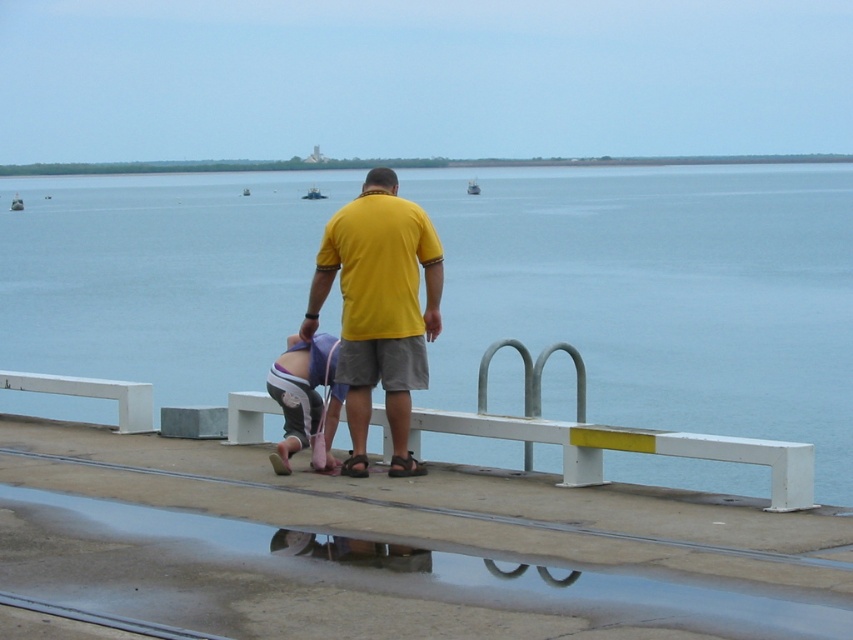
You are standing on the pier and want to pick up an item located at point [335,404]. There is another item at point [213,198]. Which item can you reach first without moving your feet?

You can reach the item at point [213,198] first because it is closer to you than the item at point [335,404].

You are a photographer trying to capture the person in the yellow matte shirt at center. According to the coordinates provided, where should you aim your camera to ensure the subject is centered in the frame?

To center the person in the yellow matte shirt at center, aim your camera at the coordinates point (379, 308) as specified in the description.